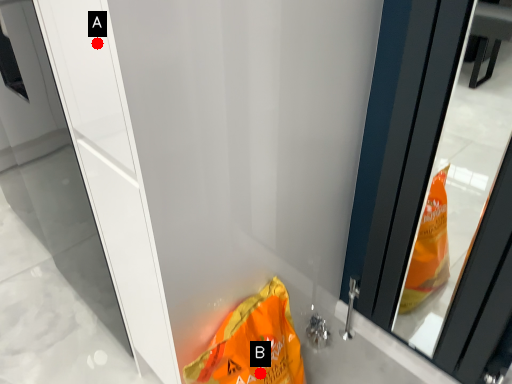
Question: Two points are circled on the image, labeled by A and B beside each circle. Which of the following is the farthest from the observer?

Choices:
 (A) A is further
 (B) B is further

Answer: (B)